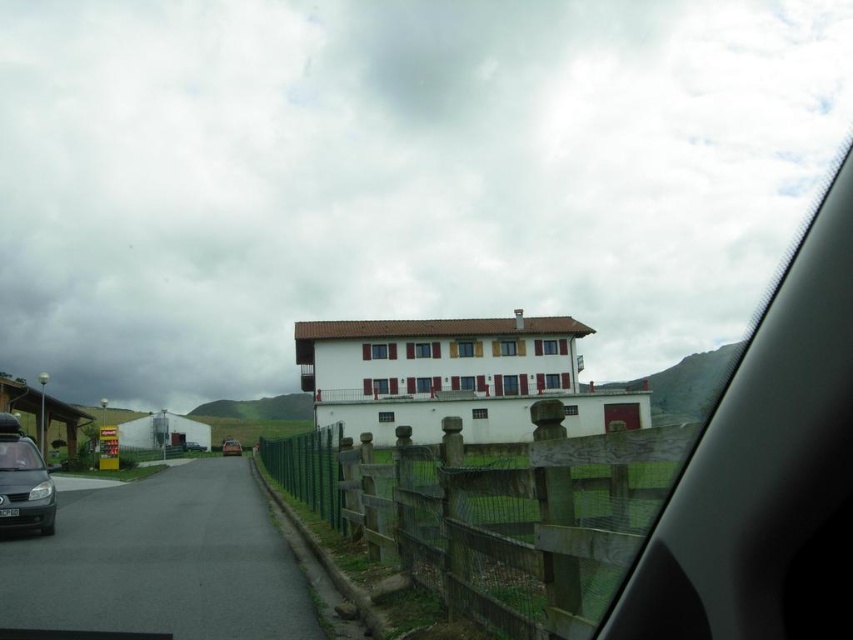
Measure the distance between wooden at center and camera.

The distance of wooden at center from camera is 63.72 feet.

Which of these two, wooden at center or matte gray car at left, stands shorter?

matte gray car at left is shorter.

The image size is (853, 640). Find the location of `wooden at center`. wooden at center is located at coordinates (496, 513).

From the picture: Does matte gray car at left have a smaller size compared to matte black car at center?

Yes.

Can you confirm if matte gray car at left is bigger than matte black car at center?

Incorrect, matte gray car at left is not larger than matte black car at center.

Is point (44, 522) farther from camera compared to point (222, 442)?

No, it is in front of (222, 442).

Where is `matte gray car at left`? This screenshot has width=853, height=640. matte gray car at left is located at coordinates (22, 481).

In the scene shown: Does wooden at center come in front of matte black car at center?

Yes, wooden at center is closer to the viewer.

Can you confirm if wooden at center is positioned to the right of matte black car at center?

Correct, you'll find wooden at center to the right of matte black car at center.

Is point (381, 528) farther from camera compared to point (230, 449)?

No, (381, 528) is in front of (230, 449).

This screenshot has height=640, width=853. In order to click on wooden at center in this screenshot , I will do `click(496, 513)`.